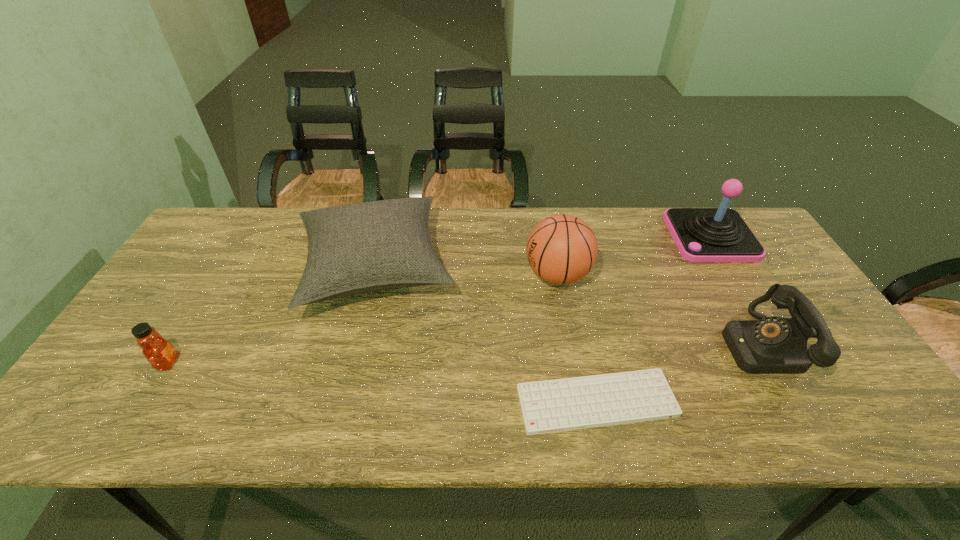
The width and height of the screenshot is (960, 540). Find the location of `vacant space located on the surface of the basketball near the brand logo`. vacant space located on the surface of the basketball near the brand logo is located at coordinates (391, 275).

The width and height of the screenshot is (960, 540). Find the location of `free space located 0.120m on the surface of the basketball near the brand logo`. free space located 0.120m on the surface of the basketball near the brand logo is located at coordinates (483, 275).

This screenshot has width=960, height=540. What are the coordinates of `blank space located 0.170m on the surface of the basketball near the brand logo` in the screenshot? It's located at (467, 275).

This screenshot has width=960, height=540. I want to click on vacant space positioned on the right of the cushion, so click(484, 267).

You are a GUI agent. You are given a task and a screenshot of the screen. Output one action in this format:
    pyautogui.click(x=<x>, y=<y>)
    Task: Click on the vacant space located 0.330m on the dial of the telephone
    
    Given the screenshot: What is the action you would take?
    pyautogui.click(x=594, y=344)

At what (x,y) coordinates should I click in order to perform the action: click on vacant space located on the dial of the telephone. Please return your answer as a coordinate pair (x, y). The image size is (960, 540). Looking at the image, I should click on (685, 344).

This screenshot has width=960, height=540. In order to click on vacant space positioned 0.280m on the dial of the telephone in this screenshot , I will do `click(614, 344)`.

Identify the location of vacant space situated 0.150m on the front label of the leftmost object. (242, 362).

Locate an element on the screen. Image resolution: width=960 pixels, height=540 pixels. vacant space located 0.140m on the back of the shortest object is located at coordinates (581, 327).

This screenshot has height=540, width=960. In order to click on joystick that is at the far edge in this screenshot , I will do `click(720, 234)`.